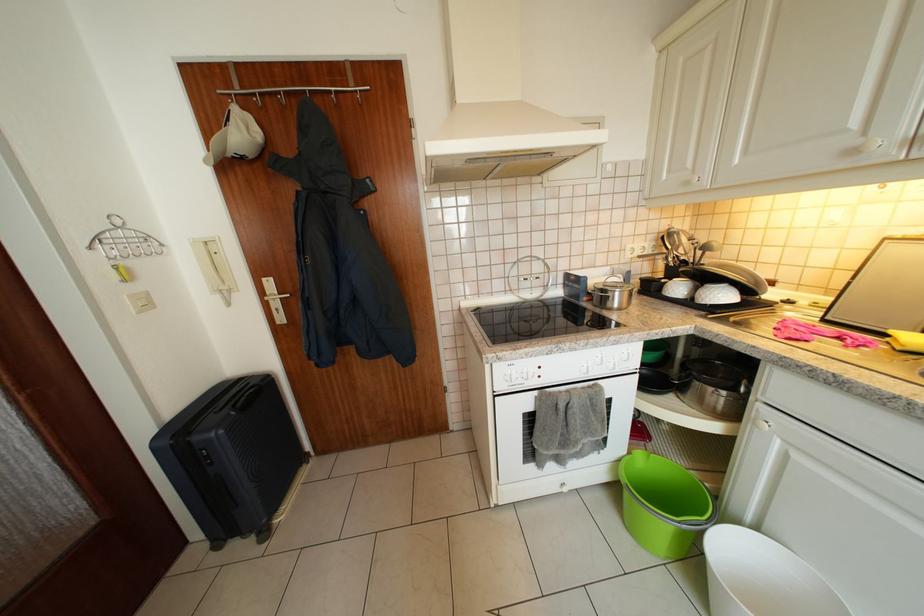
I want to click on door handle, so click(274, 299).